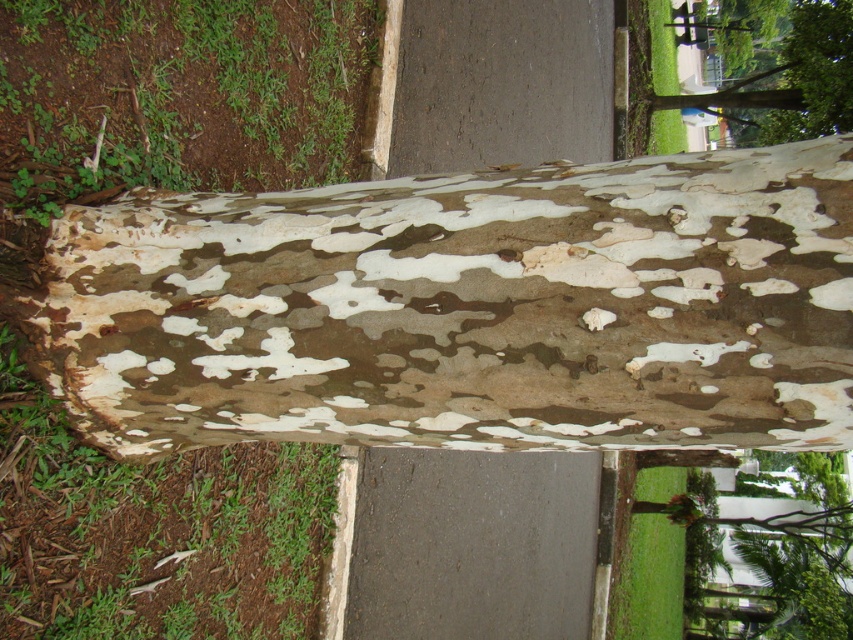
Find the location of a particular element. This screenshot has height=640, width=853. speckled bark tree trunk at center is located at coordinates (467, 308).

Which of these two, speckled bark tree trunk at center or camouflage bark tree at upper right, stands taller?

With more height is camouflage bark tree at upper right.

Does point (312, 259) lie in front of point (846, 17)?

Yes, it is in front of point (846, 17).

Image resolution: width=853 pixels, height=640 pixels. I want to click on speckled bark tree trunk at center, so click(x=467, y=308).